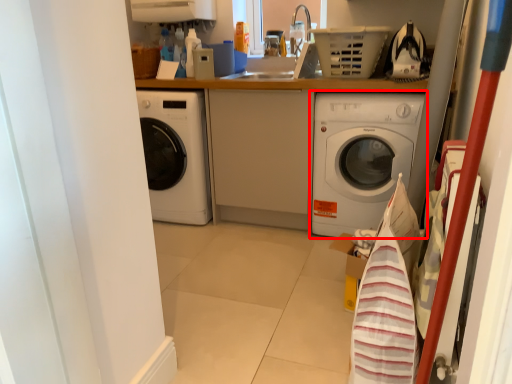
Question: From the image's perspective, what is the correct spatial relationship of washing machine (annotated by the red box) in relation to basket?

Choices:
 (A) above
 (B) below

Answer: (B)